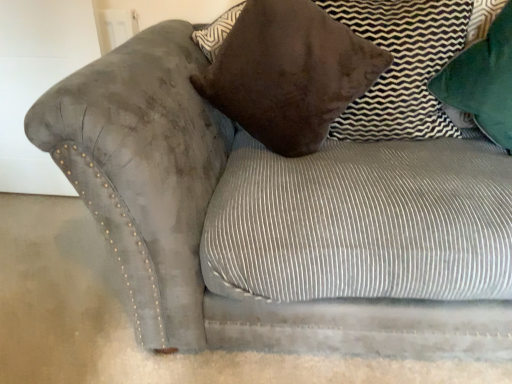
Question: Is green velvet pillow at upper right, which ranks as the 3th pillow in left-to-right order, behind brown suede pillow at upper right, which is counted as the 2th pillow, starting from the left?

Choices:
 (A) yes
 (B) no

Answer: (B)

Question: Can you confirm if green velvet pillow at upper right, arranged as the first pillow when viewed from the right, is taller than brown suede pillow at upper right, which is counted as the 2th pillow, starting from the left?

Choices:
 (A) no
 (B) yes

Answer: (B)

Question: Is green velvet pillow at upper right, arranged as the first pillow when viewed from the right, at the left side of brown suede pillow at upper right, which is counted as the 2th pillow, starting from the left?

Choices:
 (A) no
 (B) yes

Answer: (A)

Question: Considering the relative sizes of green velvet pillow at upper right, arranged as the first pillow when viewed from the right, and brown suede pillow at upper right, which is counted as the 2th pillow, starting from the left, in the image provided, is green velvet pillow at upper right, arranged as the first pillow when viewed from the right, wider than brown suede pillow at upper right, which is counted as the 2th pillow, starting from the left,?

Choices:
 (A) no
 (B) yes

Answer: (B)

Question: Is brown suede pillow at upper right, which is counted as the 2th pillow, starting from the left, at the back of green velvet pillow at upper right, which ranks as the 3th pillow in left-to-right order?

Choices:
 (A) no
 (B) yes

Answer: (A)

Question: In the image, is velvet brown pillow at upper center, marked as the first pillow in a left-to-right arrangement, on the left side or the right side of green velvet pillow at upper right, arranged as the first pillow when viewed from the right?

Choices:
 (A) left
 (B) right

Answer: (A)

Question: From the image's perspective, is velvet brown pillow at upper center, which is counted as the 3th pillow, starting from the right, above or below green velvet pillow at upper right, arranged as the first pillow when viewed from the right?

Choices:
 (A) above
 (B) below

Answer: (B)

Question: Looking at their shapes, would you say velvet brown pillow at upper center, marked as the first pillow in a left-to-right arrangement, is wider or thinner than green velvet pillow at upper right, which ranks as the 3th pillow in left-to-right order?

Choices:
 (A) thin
 (B) wide

Answer: (B)

Question: Relative to green velvet pillow at upper right, which ranks as the 3th pillow in left-to-right order, is velvet brown pillow at upper center, which is counted as the 3th pillow, starting from the right, in front or behind?

Choices:
 (A) behind
 (B) front

Answer: (B)

Question: In terms of size, does green velvet pillow at upper right, arranged as the first pillow when viewed from the right, appear bigger or smaller than brown suede pillow at upper right, acting as the 2th pillow starting from the right?

Choices:
 (A) big
 (B) small

Answer: (B)

Question: Visually, is green velvet pillow at upper right, which ranks as the 3th pillow in left-to-right order, positioned to the left or to the right of brown suede pillow at upper right, acting as the 2th pillow starting from the right?

Choices:
 (A) right
 (B) left

Answer: (A)

Question: From the image's perspective, is green velvet pillow at upper right, which ranks as the 3th pillow in left-to-right order, located above or below brown suede pillow at upper right, acting as the 2th pillow starting from the right?

Choices:
 (A) above
 (B) below

Answer: (B)

Question: Looking at their shapes, would you say green velvet pillow at upper right, arranged as the first pillow when viewed from the right, is wider or thinner than brown suede pillow at upper right, which is counted as the 2th pillow, starting from the left?

Choices:
 (A) thin
 (B) wide

Answer: (B)

Question: From their relative heights in the image, would you say brown suede pillow at upper right, which is counted as the 2th pillow, starting from the left, is taller or shorter than green velvet pillow at upper right, arranged as the first pillow when viewed from the right?

Choices:
 (A) tall
 (B) short

Answer: (B)

Question: Does point (388, 120) appear closer or farther from the camera than point (501, 67)?

Choices:
 (A) farther
 (B) closer

Answer: (A)